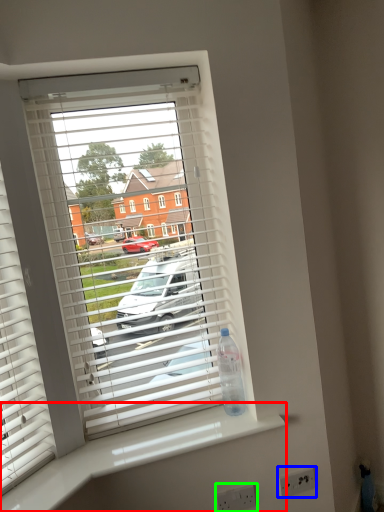
Question: Estimate the real-world distances between objects in this image. Which object is closer to counter top (highlighted by a red box), electric outlet (highlighted by a blue box) or electric outlet (highlighted by a green box)?

Choices:
 (A) electric outlet
 (B) electric outlet

Answer: (B)